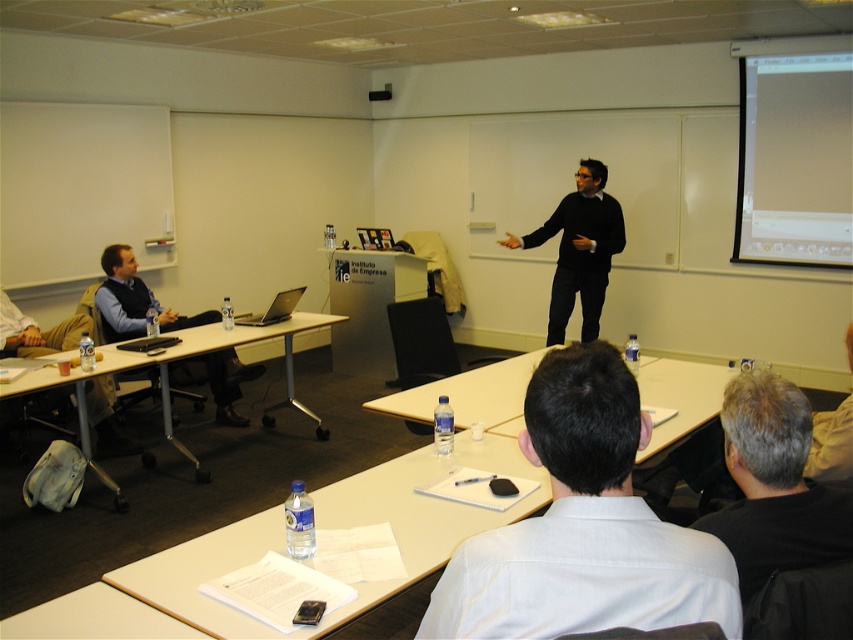
Question: Can you confirm if white shirt at center is wider than gray hair at back?

Choices:
 (A) no
 (B) yes

Answer: (B)

Question: Which object appears farthest from the camera in this image?

Choices:
 (A) matte white projector screen at upper right
 (B) black sweater at center

Answer: (A)

Question: Is white plastic table at left closer to camera compared to silver metallic table at center?

Choices:
 (A) yes
 (B) no

Answer: (A)

Question: Which point is closer to the camera?

Choices:
 (A) matte black vest at left
 (B) white shirt at center

Answer: (B)

Question: Considering the relative positions of white shirt at center and matte white projector screen at upper right in the image provided, where is white shirt at center located with respect to matte white projector screen at upper right?

Choices:
 (A) right
 (B) left

Answer: (B)

Question: Which point appears farthest from the camera in this image?

Choices:
 (A) (738, 397)
 (B) (705, 589)
 (C) (165, 408)

Answer: (C)